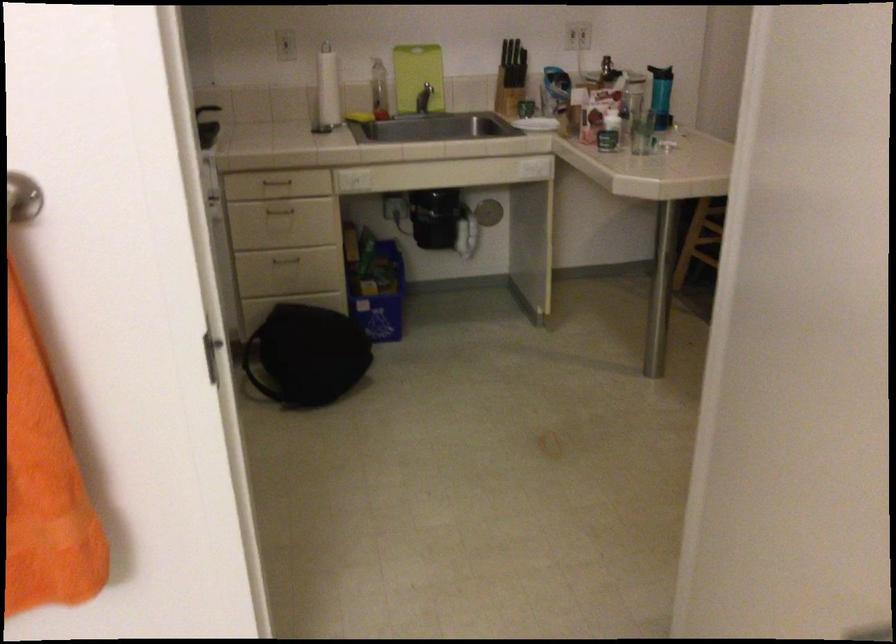
Which object does [378,90] point to?

It corresponds to the clear spray bottle in the image.